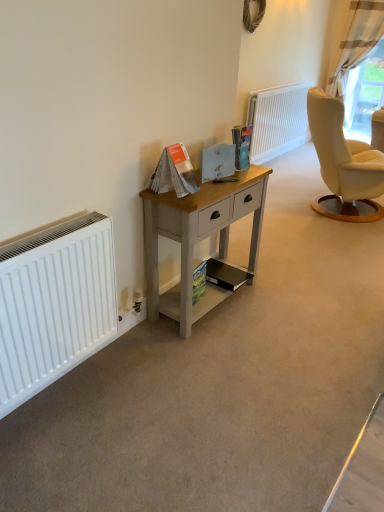
Where is `vacant area that lies in front of matte blue card at center, which is counted as the second magazine, starting from the top`? This screenshot has height=512, width=384. vacant area that lies in front of matte blue card at center, which is counted as the second magazine, starting from the top is located at coordinates (213, 189).